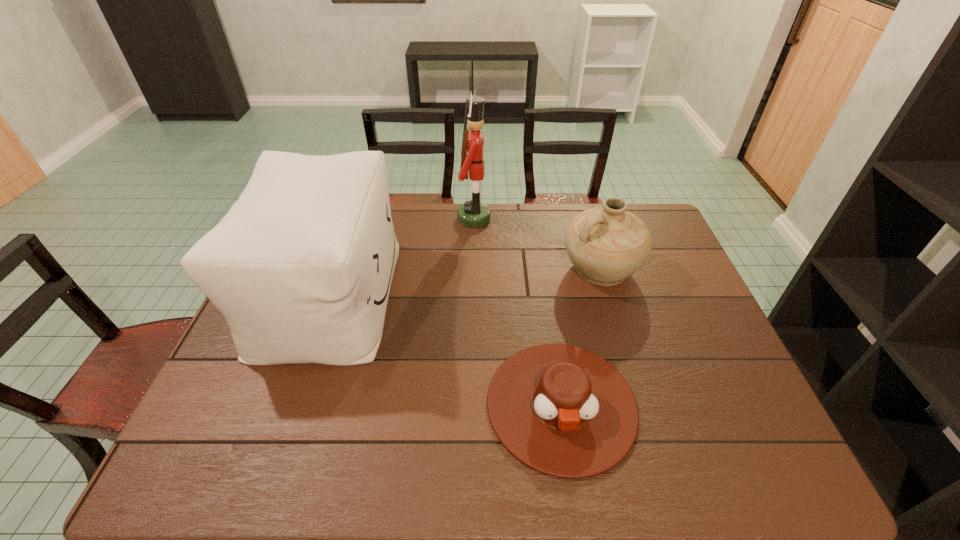
The image size is (960, 540). Identify the location of the farthest object. (473, 214).

This screenshot has width=960, height=540. What are the coordinates of `the tallest object` in the screenshot? It's located at (473, 214).

The height and width of the screenshot is (540, 960). Find the location of `the second tallest object`. the second tallest object is located at coordinates (301, 267).

Locate an element on the screen. Image resolution: width=960 pixels, height=540 pixels. cushion is located at coordinates (301, 267).

I want to click on the second shortest object, so click(606, 245).

At what (x,y) coordinates should I click in order to perform the action: click on the shortest object. Please return your answer as a coordinate pair (x, y). The width and height of the screenshot is (960, 540). Looking at the image, I should click on (561, 410).

Identify the location of vacant space situated 0.340m on the front-facing side of the tallest object. The image size is (960, 540). (585, 218).

At what (x,y) coordinates should I click in order to perform the action: click on free region located on the side of the cushion with the smiley face. Please return your answer as a coordinate pair (x, y). This screenshot has height=540, width=960. Looking at the image, I should click on (455, 295).

You are a GUI agent. You are given a task and a screenshot of the screen. Output one action in this format:
    pyautogui.click(x=<x>, y=<y>)
    Task: Click on the free space located 0.170m on the left of the pottery
    
    Given the screenshot: What is the action you would take?
    pyautogui.click(x=507, y=269)

The image size is (960, 540). Find the location of `nutcracker that is at the far edge`. nutcracker that is at the far edge is located at coordinates (473, 214).